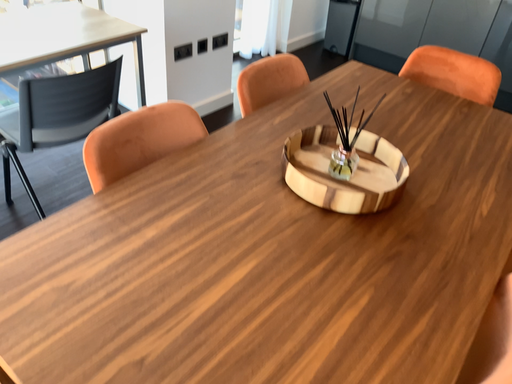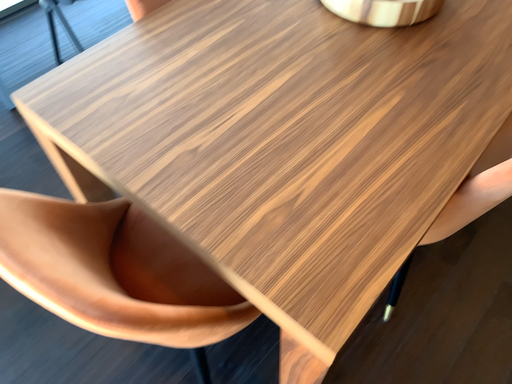
Question: How did the camera likely rotate when shooting the video?

Choices:
 (A) rotated upward
 (B) rotated downward

Answer: (B)